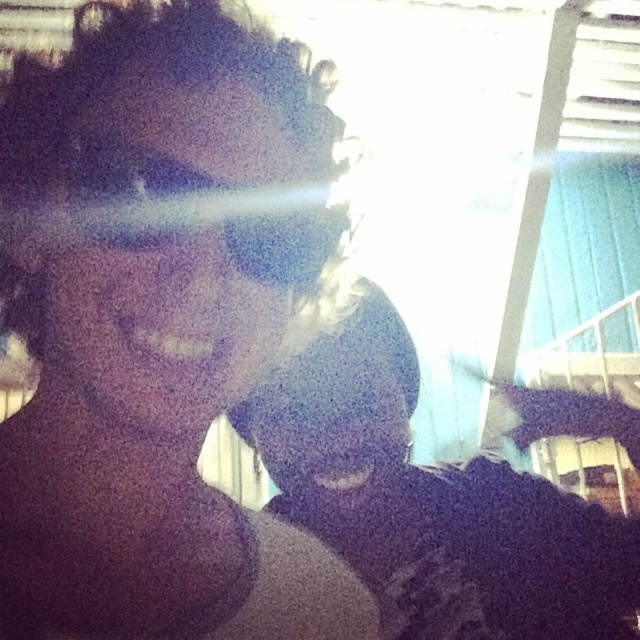
You are a photographer trying to capture a clear image of the dark fabric at center and the matte black goggles at center in the selfie. Since the background is overexposed, which object should you adjust your focus on to ensure both are visible?

The dark fabric at center is taller than matte black goggles at center, so focusing on the dark fabric at center would help ensure both objects are in frame and visible.

You are a photographer adjusting your camera settings. You notice the matte black hair at upper left and the matte black goggles at center in your viewfinder. Which object should you focus on first if you want to capture both in sharp detail without moving the camera?

The matte black hair at upper left should be focused on first because it is closer to the camera than the matte black goggles at center. Focusing on the closer object ensures both will be in focus if they are within the depth of field.